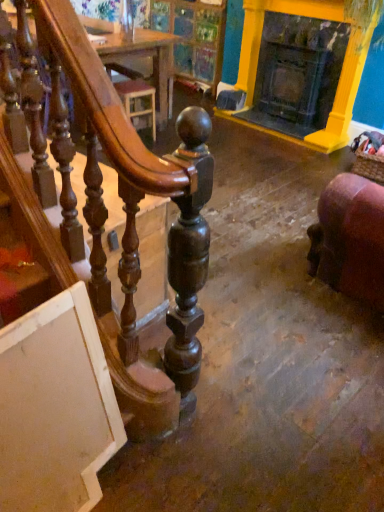
Question: Is wooden table at upper center bigger than yellow painted wood fireplace at upper right?

Choices:
 (A) no
 (B) yes

Answer: (B)

Question: Does wooden table at upper center come behind yellow painted wood fireplace at upper right?

Choices:
 (A) yes
 (B) no

Answer: (A)

Question: Is wooden table at upper center closer to the viewer compared to yellow painted wood fireplace at upper right?

Choices:
 (A) yes
 (B) no

Answer: (B)

Question: Is there a large distance between wooden table at upper center and yellow painted wood fireplace at upper right?

Choices:
 (A) yes
 (B) no

Answer: (A)

Question: Is wooden table at upper center directly adjacent to yellow painted wood fireplace at upper right?

Choices:
 (A) yes
 (B) no

Answer: (B)

Question: Looking at the image, does wooden table at upper center seem bigger or smaller compared to purple velvet chair at lower right?

Choices:
 (A) small
 (B) big

Answer: (A)

Question: Which is correct: wooden table at upper center is inside purple velvet chair at lower right, or outside of it?

Choices:
 (A) outside
 (B) inside

Answer: (A)

Question: From their relative heights in the image, would you say wooden table at upper center is taller or shorter than purple velvet chair at lower right?

Choices:
 (A) short
 (B) tall

Answer: (A)

Question: In the image, is wooden table at upper center positioned in front of or behind purple velvet chair at lower right?

Choices:
 (A) front
 (B) behind

Answer: (B)

Question: Considering the positions of wooden table at upper center and yellow painted wood fireplace at upper right in the image, is wooden table at upper center wider or thinner than yellow painted wood fireplace at upper right?

Choices:
 (A) thin
 (B) wide

Answer: (B)

Question: In the image, is wooden table at upper center positioned in front of or behind yellow painted wood fireplace at upper right?

Choices:
 (A) front
 (B) behind

Answer: (B)

Question: Looking at the image, does wooden table at upper center seem bigger or smaller compared to yellow painted wood fireplace at upper right?

Choices:
 (A) big
 (B) small

Answer: (A)

Question: From a real-world perspective, is wooden table at upper center positioned above or below yellow painted wood fireplace at upper right?

Choices:
 (A) above
 (B) below

Answer: (B)

Question: Does point tap(317, 271) appear closer or farther from the camera than point tap(301, 106)?

Choices:
 (A) closer
 (B) farther

Answer: (A)

Question: Is purple velvet chair at lower right spatially inside yellow painted wood fireplace at upper right, or outside of it?

Choices:
 (A) inside
 (B) outside

Answer: (B)